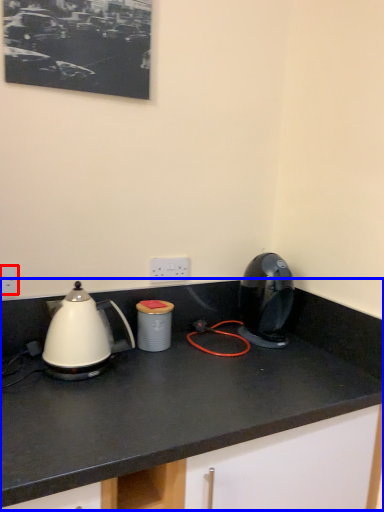
Question: Which object appears farthest to the camera in this image, electric outlet (highlighted by a red box) or countertop (highlighted by a blue box)?

Choices:
 (A) electric outlet
 (B) countertop

Answer: (A)